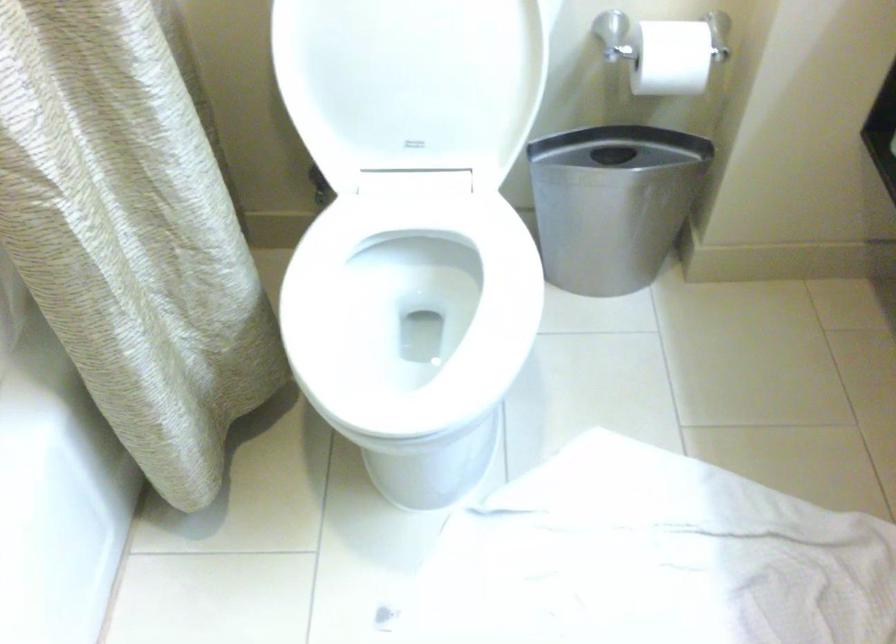
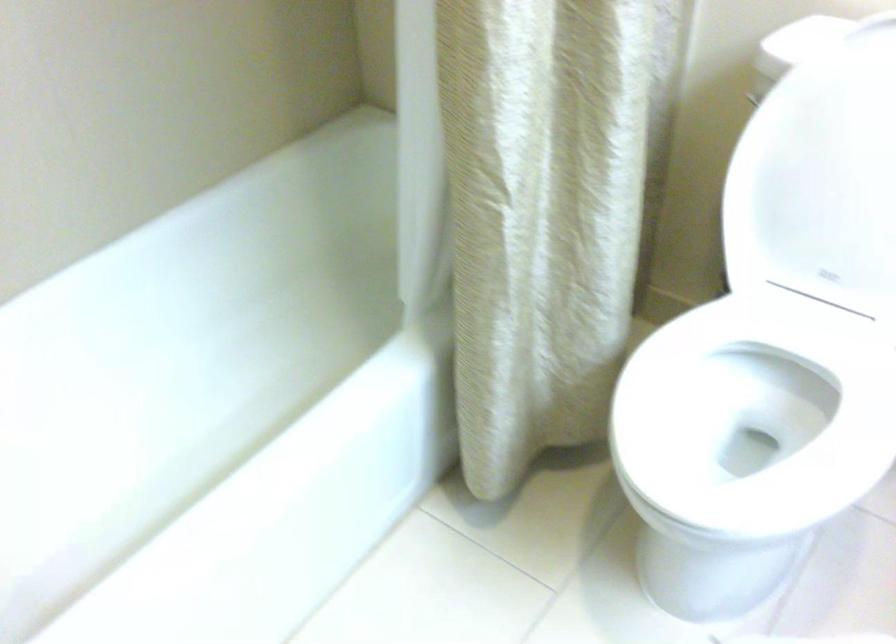
In the second image, find the point that corresponds to point (409, 301) in the first image.

(752, 420)